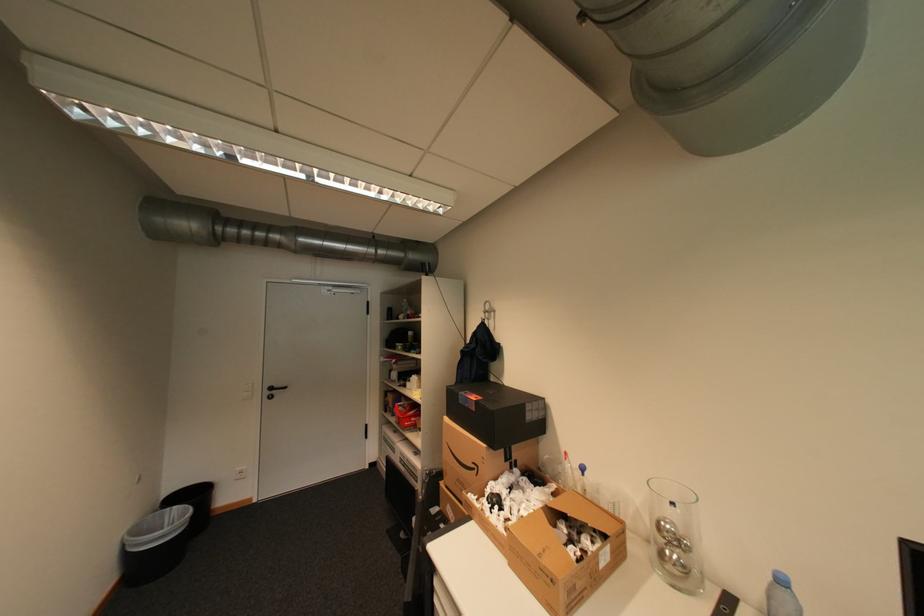
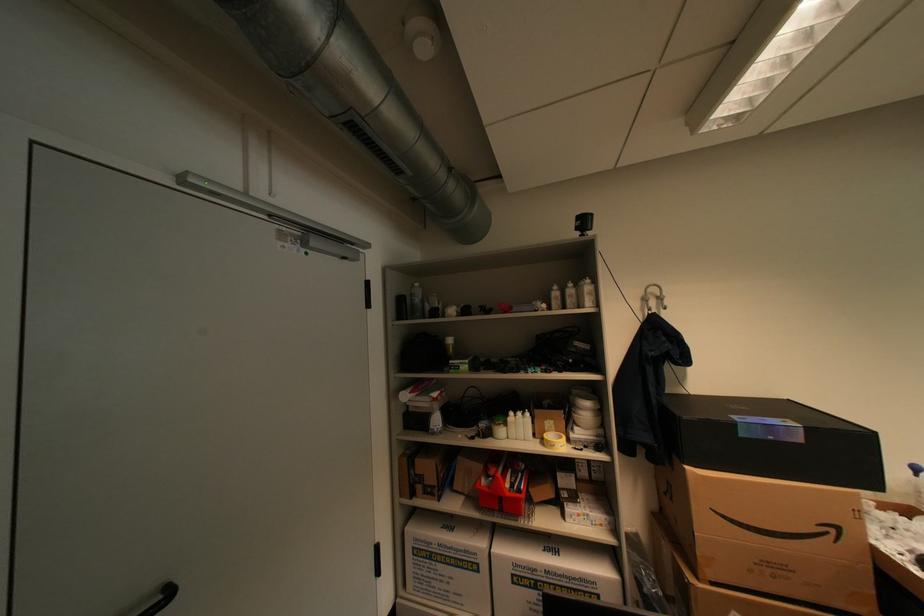
The point at (x=406, y=415) is marked in the first image. Where is the corresponding point in the second image?

(516, 495)